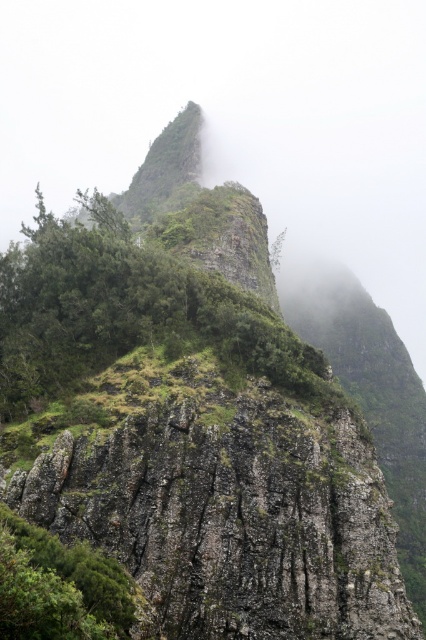
Who is more forward, (146, 333) or (22, 520)?

Positioned in front is point (22, 520).

How far apart are green leafy shrubs at center and green leafy shrub at lower left?

50.87 feet

Which is in front, point (69, 385) or point (112, 572)?

Positioned in front is point (112, 572).

Find the location of a particular element. This screenshot has width=426, height=640. green leafy shrubs at center is located at coordinates (126, 314).